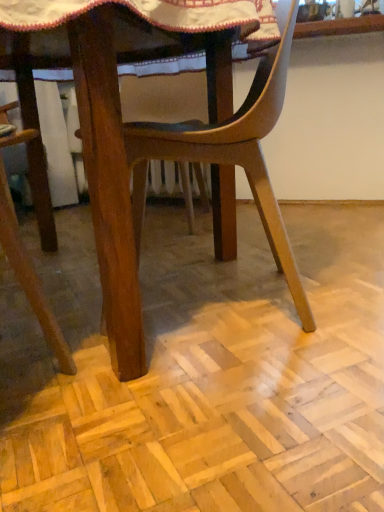
The image size is (384, 512). I want to click on vacant space in front of wooden chair at center, so click(x=236, y=390).